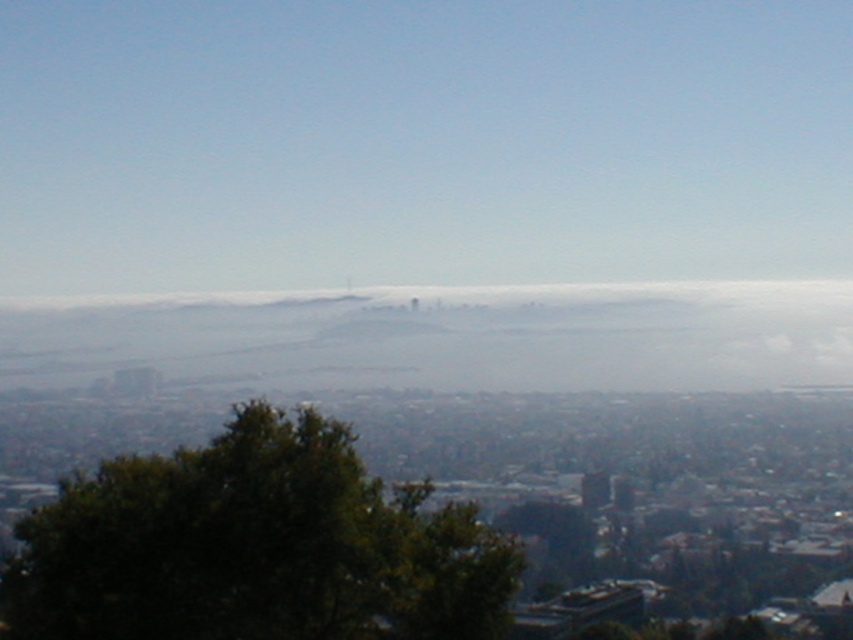
Question: Considering the relative positions of green leafy tree at center and foggy white cloud at center in the image provided, where is green leafy tree at center located with respect to foggy white cloud at center?

Choices:
 (A) above
 (B) below

Answer: (B)

Question: Does green leafy tree at center come in front of foggy white cloud at center?

Choices:
 (A) yes
 (B) no

Answer: (B)

Question: Is green leafy tree at center below foggy white cloud at center?

Choices:
 (A) yes
 (B) no

Answer: (A)

Question: Which point is farther to the camera?

Choices:
 (A) foggy white cloud at center
 (B) green leafy tree at center

Answer: (B)

Question: Which point appears farthest from the camera in this image?

Choices:
 (A) (286, 620)
 (B) (70, 328)

Answer: (B)